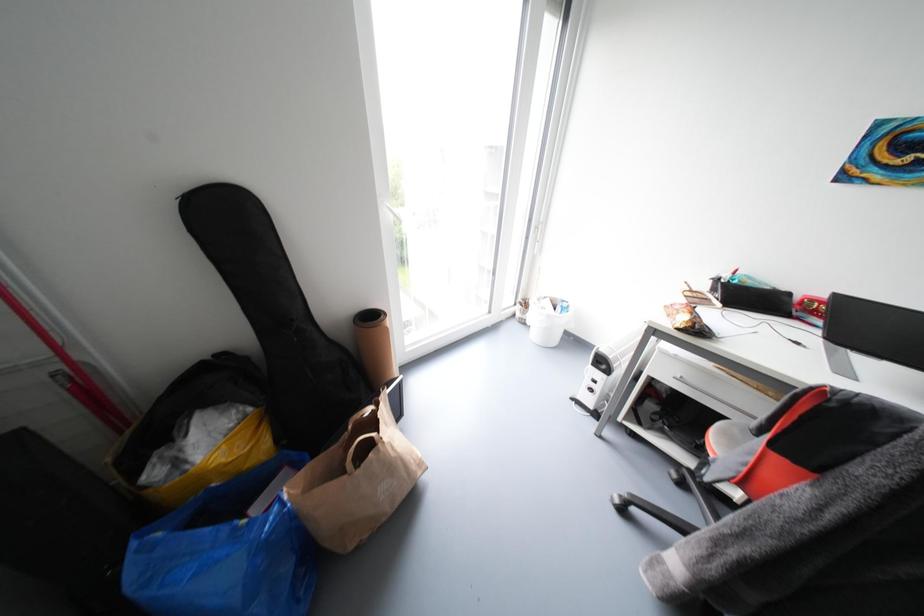
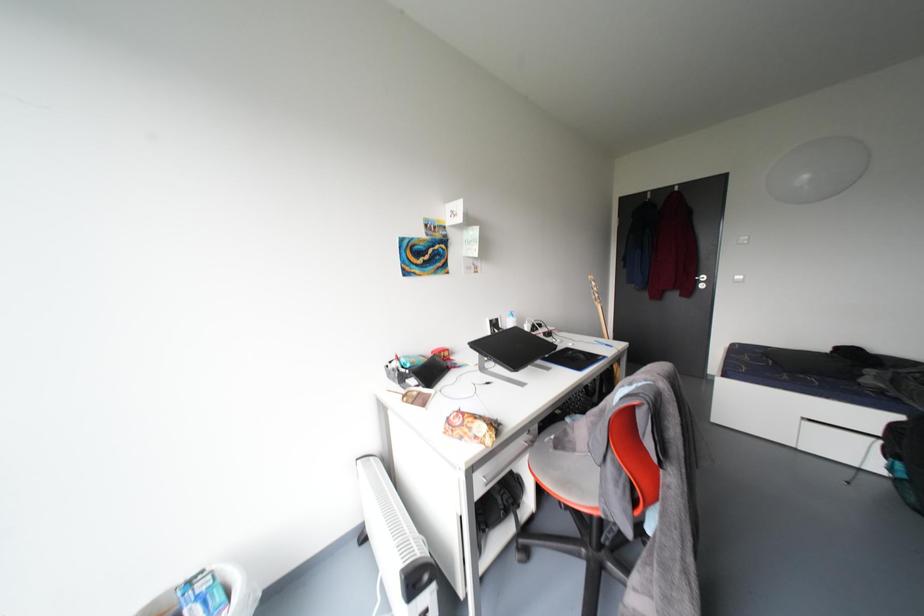
Question: The images are taken continuously from a first-person perspective. In which direction is your viewpoint rotating?

Choices:
 (A) Left
 (B) Right
 (C) Up
 (D) Down

Answer: (B)